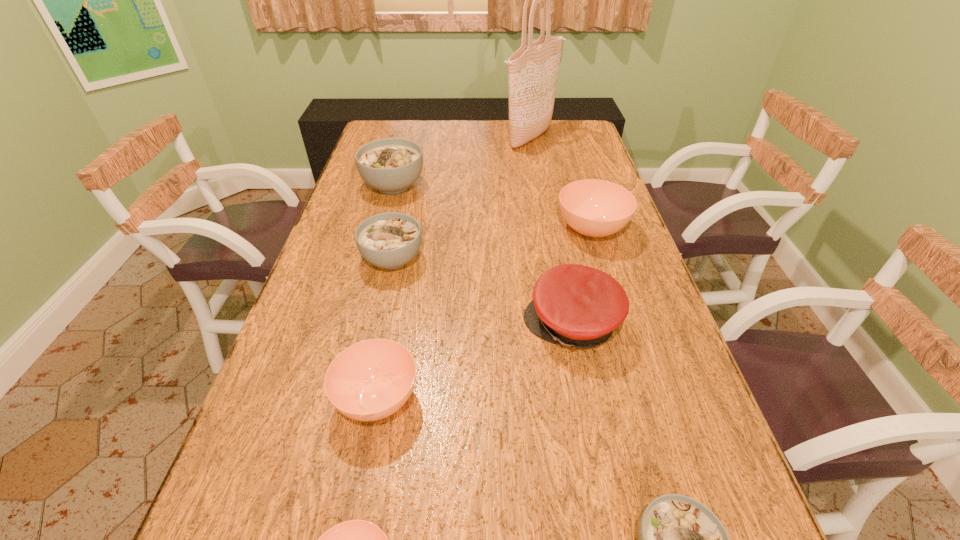
Identify the location of vacant space that is in between the farthest object and the second farthest peach soup bowl. The height and width of the screenshot is (540, 960). (454, 268).

Find the location of a particular element. Image resolution: width=960 pixels, height=540 pixels. free spot between the second farthest peach soup bowl and the farthest peach soup bowl is located at coordinates (485, 314).

The height and width of the screenshot is (540, 960). What are the coordinates of `object that is the sixth closest one to the second nearest peach soup bowl` in the screenshot? It's located at 391,165.

Locate which object ranks fourth in proximity to the shortest soup bowl. Please provide its 2D coordinates. Your answer should be formatted as a tuple, i.e. [(x, y)], where the tuple contains the x and y coordinates of a point satisfying the conditions above.

[(390, 240)]

Where is `soup bowl that stands as the third closest to the rightmost peach soup bowl`? soup bowl that stands as the third closest to the rightmost peach soup bowl is located at coordinates [370, 380].

Locate an element on the screen. This screenshot has height=540, width=960. soup bowl that is the nearest to the biggest peach soup bowl is located at coordinates (390, 240).

Locate which white soup bowl is the third closest to the farthest object. Please provide its 2D coordinates. Your answer should be formatted as a tuple, i.e. [(x, y)], where the tuple contains the x and y coordinates of a point satisfying the conditions above.

[(679, 539)]

Identify which white soup bowl is the closest to the smallest white soup bowl. Please provide its 2D coordinates. Your answer should be formatted as a tuple, i.e. [(x, y)], where the tuple contains the x and y coordinates of a point satisfying the conditions above.

[(390, 240)]

The width and height of the screenshot is (960, 540). In order to click on the closest peach soup bowl to the nearest peach soup bowl in this screenshot , I will do `click(370, 380)`.

The image size is (960, 540). I want to click on peach soup bowl that is the second closest to the cap, so click(x=370, y=380).